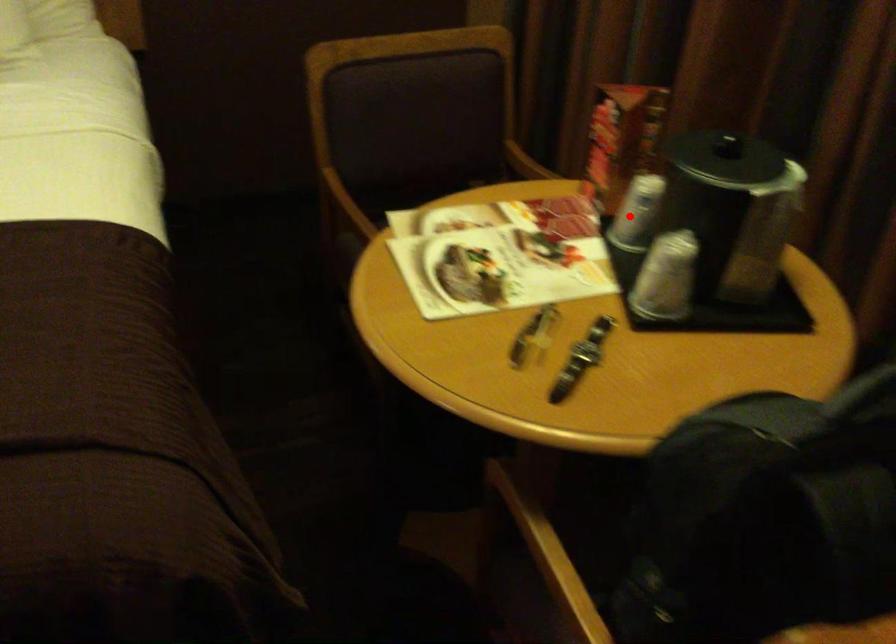
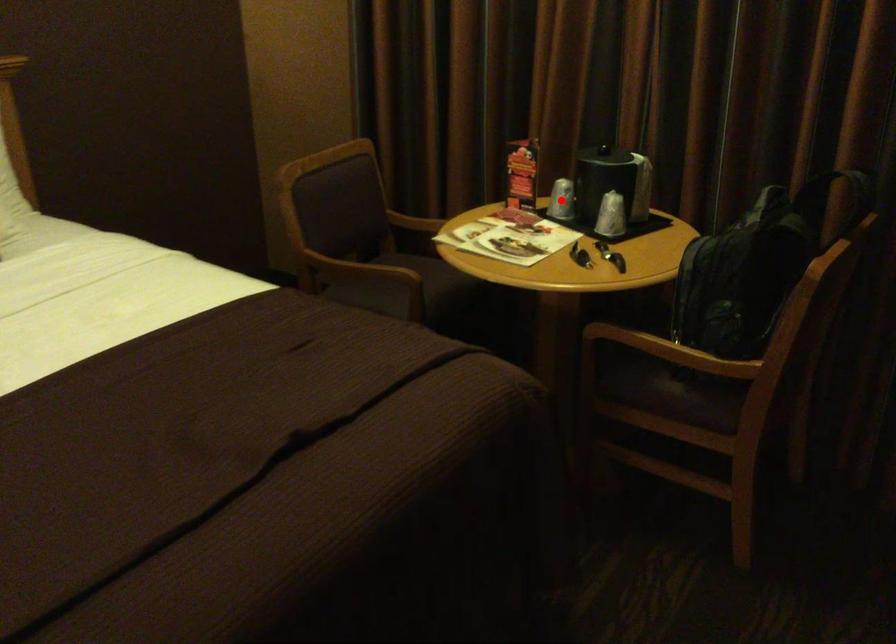
I am providing you with two images of the same scene from different viewpoints. A red point is marked on the first image and another point is marked on the second image. Is the red point in image1 aligned with the point shown in image2?

Yes